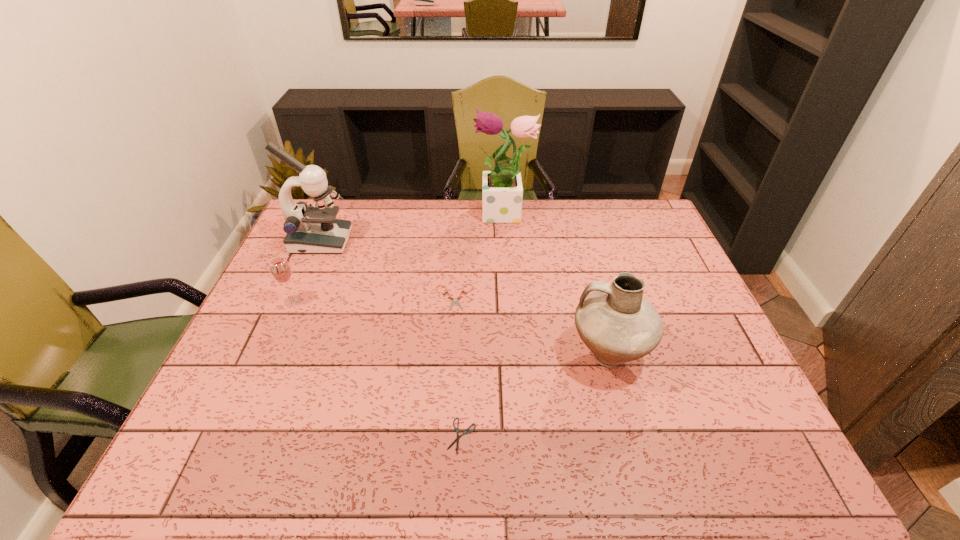
Locate an element on the screen. The image size is (960, 540). vacant space located 0.120m on the front-facing side of the flower arrangement is located at coordinates (441, 215).

The width and height of the screenshot is (960, 540). What are the coordinates of `vacant space located on the front-facing side of the flower arrangement` in the screenshot? It's located at (410, 215).

The image size is (960, 540). Identify the location of vacant space located 0.110m on the back of the microscope. (334, 211).

Image resolution: width=960 pixels, height=540 pixels. I want to click on vacant space located on the handle side of the rightmost object, so click(490, 355).

Locate an element on the screen. free region located 0.200m on the handle side of the rightmost object is located at coordinates (490, 355).

This screenshot has height=540, width=960. Find the location of `free location located on the handle side of the rightmost object`. free location located on the handle side of the rightmost object is located at coordinates (490, 355).

You are a GUI agent. You are given a task and a screenshot of the screen. Output one action in this format:
    pyautogui.click(x=<x>, y=<y>)
    Task: Click on the vacant space located on the right of the wineglass
    Image resolution: width=960 pixels, height=540 pixels.
    Given the screenshot: What is the action you would take?
    pyautogui.click(x=393, y=301)

Locate an element on the screen. blank space located on the front of the taller shears is located at coordinates (446, 415).

Where is `free location located 0.350m on the back of the shortest object`? This screenshot has width=960, height=540. free location located 0.350m on the back of the shortest object is located at coordinates (466, 306).

Where is `flower arrangement that is at the far edge`? This screenshot has height=540, width=960. flower arrangement that is at the far edge is located at coordinates (502, 192).